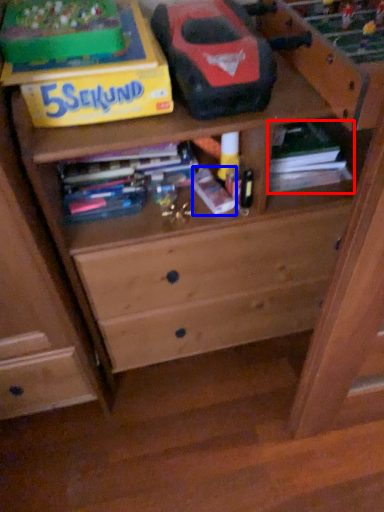
Question: Which object is closer to the camera taking this photo, book (highlighted by a red box) or book (highlighted by a blue box)?

Choices:
 (A) book
 (B) book

Answer: (B)